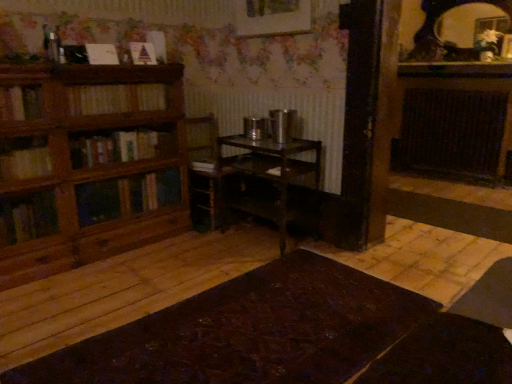
Question: Considering the relative sizes of metallic dark brown table at center, placed as the 1th table when sorted from top to bottom, and wooden picture frame at upper center in the image provided, is metallic dark brown table at center, placed as the 1th table when sorted from top to bottom, bigger than wooden picture frame at upper center?

Choices:
 (A) yes
 (B) no

Answer: (A)

Question: Does metallic dark brown table at center, the second table positioned from the bottom, have a lesser height compared to wooden picture frame at upper center?

Choices:
 (A) yes
 (B) no

Answer: (B)

Question: From the image's perspective, is metallic dark brown table at center, the second table positioned from the bottom, located above wooden picture frame at upper center?

Choices:
 (A) no
 (B) yes

Answer: (A)

Question: Are metallic dark brown table at center, the second table positioned from the bottom, and wooden picture frame at upper center making contact?

Choices:
 (A) no
 (B) yes

Answer: (A)

Question: Considering the relative sizes of metallic dark brown table at center, the second table positioned from the bottom, and wooden picture frame at upper center in the image provided, is metallic dark brown table at center, the second table positioned from the bottom, thinner than wooden picture frame at upper center?

Choices:
 (A) no
 (B) yes

Answer: (A)

Question: Which is correct: dark brown wooden table at center, placed as the second table when sorted from top to bottom, is inside matte paper book at upper left, placed as the first book when sorted from top to bottom, or outside of it?

Choices:
 (A) inside
 (B) outside

Answer: (B)

Question: From the image's perspective, is dark brown wooden table at center, placed as the second table when sorted from top to bottom, located above or below matte paper book at upper left, which ranks as the 3th book in bottom-to-top order?

Choices:
 (A) below
 (B) above

Answer: (A)

Question: Considering the positions of dark brown wooden table at center, positioned as the first table in bottom-to-top order, and matte paper book at upper left, placed as the first book when sorted from top to bottom, in the image, is dark brown wooden table at center, positioned as the first table in bottom-to-top order, bigger or smaller than matte paper book at upper left, placed as the first book when sorted from top to bottom,?

Choices:
 (A) small
 (B) big

Answer: (B)

Question: Is point (339, 344) closer or farther from the camera than point (135, 61)?

Choices:
 (A) closer
 (B) farther

Answer: (A)

Question: In terms of width, does metallic dark brown table at center, the second table positioned from the bottom, look wider or thinner when compared to wooden bookshelf at left?

Choices:
 (A) thin
 (B) wide

Answer: (B)

Question: From the image's perspective, is metallic dark brown table at center, placed as the 1th table when sorted from top to bottom, located above or below wooden bookshelf at left?

Choices:
 (A) below
 (B) above

Answer: (A)

Question: Visually, is metallic dark brown table at center, placed as the 1th table when sorted from top to bottom, positioned to the left or to the right of wooden bookshelf at left?

Choices:
 (A) left
 (B) right

Answer: (B)

Question: In terms of size, does metallic dark brown table at center, placed as the 1th table when sorted from top to bottom, appear bigger or smaller than wooden bookshelf at left?

Choices:
 (A) small
 (B) big

Answer: (A)

Question: Would you say wooden bookshelf at left is to the left or to the right of wooden bookshelf at left, which appears as the third book when viewed from the top, in the picture?

Choices:
 (A) right
 (B) left

Answer: (B)

Question: Is point (176, 193) positioned closer to the camera than point (91, 110)?

Choices:
 (A) closer
 (B) farther

Answer: (B)